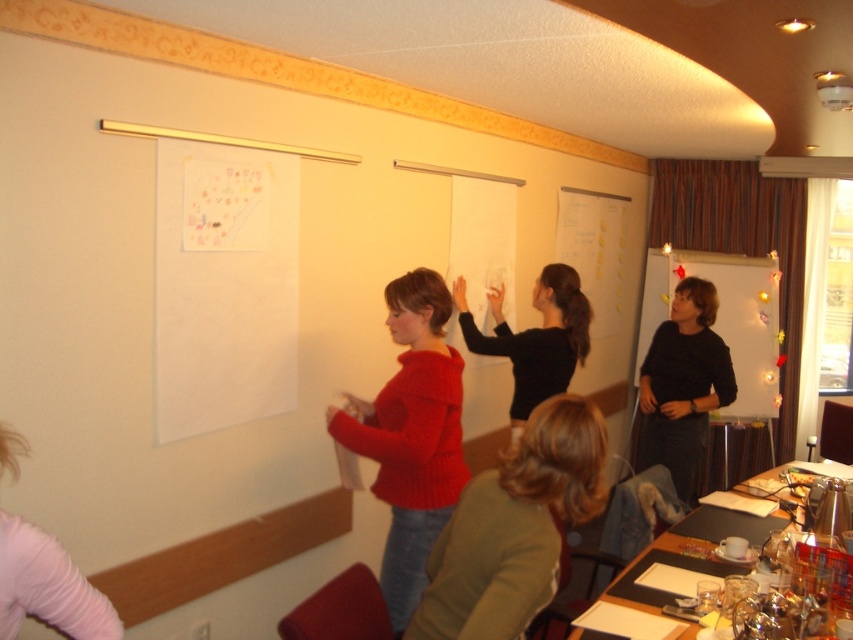
From the picture: Is green matte sweater at center taller than white matte whiteboard at center right?

No, green matte sweater at center is not taller than white matte whiteboard at center right.

Is green matte sweater at center below white matte whiteboard at center right?

Correct, green matte sweater at center is located below white matte whiteboard at center right.

Where is `green matte sweater at center`? The width and height of the screenshot is (853, 640). green matte sweater at center is located at coordinates point(514,528).

Is white matte whiteboard at center right to the left of wooden table at lower right from the viewer's perspective?

Incorrect, white matte whiteboard at center right is not on the left side of wooden table at lower right.

Can you confirm if white matte whiteboard at center right is smaller than wooden table at lower right?

Actually, white matte whiteboard at center right might be larger than wooden table at lower right.

You are a GUI agent. You are given a task and a screenshot of the screen. Output one action in this format:
    pyautogui.click(x=<x>, y=<y>)
    Task: Click on the white matte whiteboard at center right
    
    Given the screenshot: What is the action you would take?
    pyautogui.click(x=723, y=317)

Who is shorter, white matte whiteboard at center right or black matte shirt at center?

With less height is black matte shirt at center.

Can you confirm if white matte whiteboard at center right is taller than black matte shirt at center?

Yes.

Is point (764, 300) farther from viewer compared to point (535, 300)?

Yes, it is.

The image size is (853, 640). I want to click on white matte whiteboard at center right, so click(x=723, y=317).